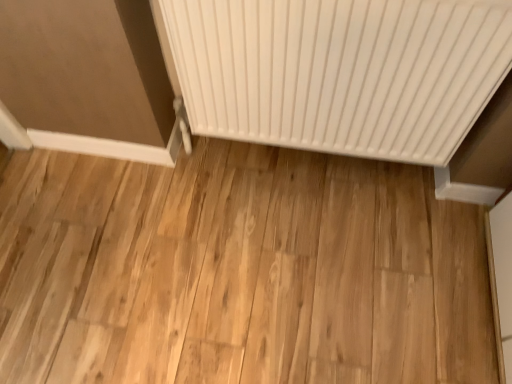
Where is `free space in front of white ribbed radiator at center`? This screenshot has width=512, height=384. free space in front of white ribbed radiator at center is located at coordinates (308, 271).